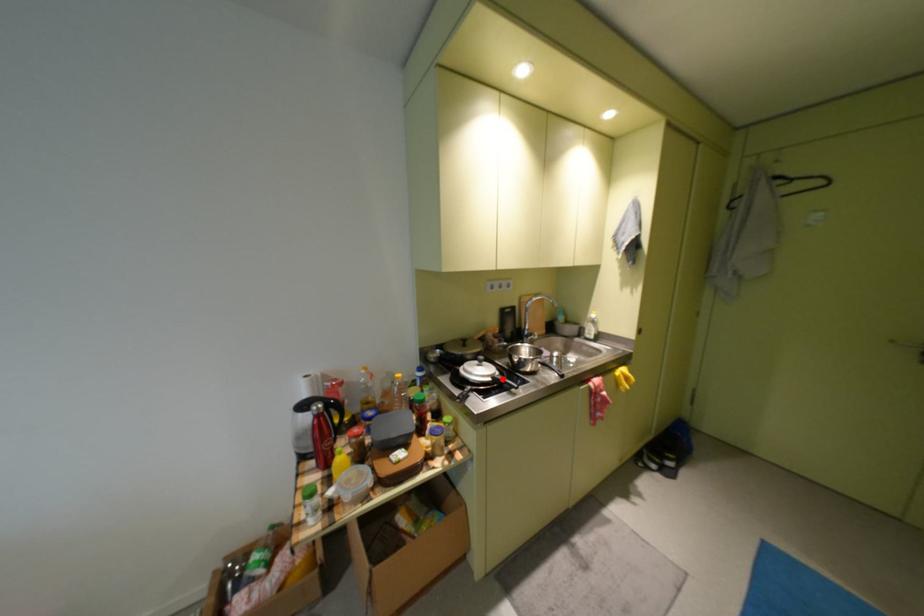
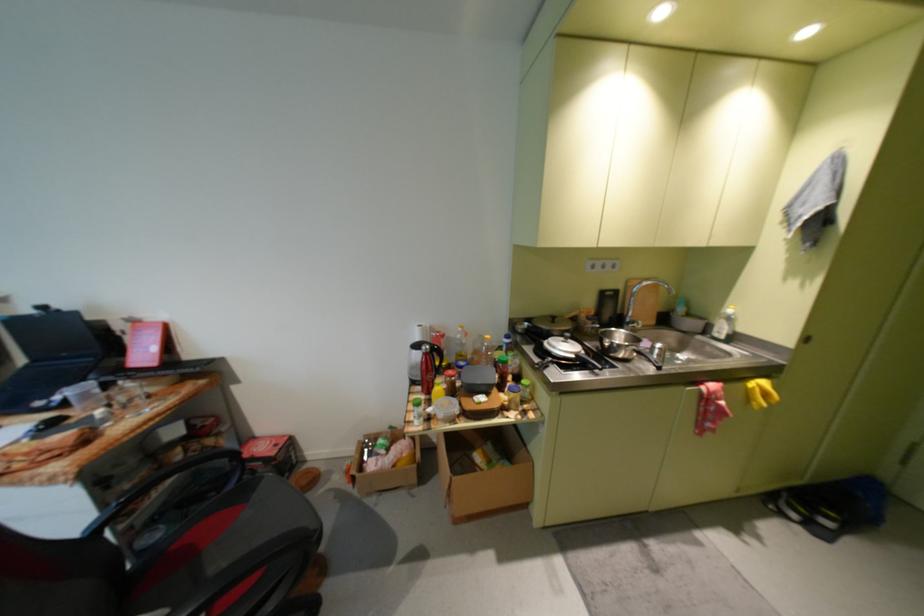
In the second image, find the point that corresponds to the highlighted location in the first image.

(586, 357)